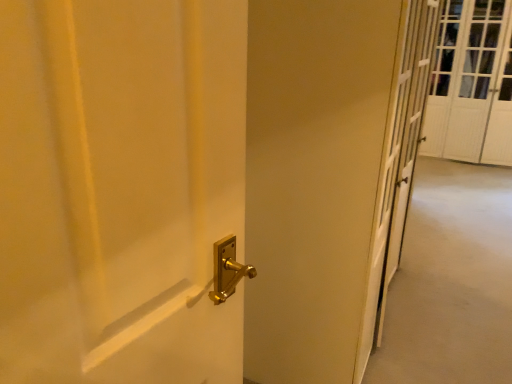
In order to face white textured screen door at upper right, should I rotate leftwards or rightwards?

You should rotate right by 28.157 degrees.

The height and width of the screenshot is (384, 512). What are the coordinates of `white textured screen door at upper right` in the screenshot? It's located at (472, 85).

This screenshot has width=512, height=384. What do you see at coordinates (472, 85) in the screenshot? I see `white textured screen door at upper right` at bounding box center [472, 85].

Identify the location of gold metallic door handle at center. (451, 281).

Describe the element at coordinates (451, 281) in the screenshot. The height and width of the screenshot is (384, 512). I see `gold metallic door handle at center` at that location.

This screenshot has height=384, width=512. In order to click on white textured screen door at upper right in this screenshot , I will do `click(472, 85)`.

Is gold metallic door handle at center at the right side of white textured screen door at upper right?

In fact, gold metallic door handle at center is to the left of white textured screen door at upper right.

Is gold metallic door handle at center further to camera compared to white textured screen door at upper right?

No, gold metallic door handle at center is in front of white textured screen door at upper right.

Does point (467, 273) appear closer or farther from the camera than point (476, 11)?

Clearly, point (467, 273) is closer to the camera than point (476, 11).

From the image's perspective, relative to white textured screen door at upper right, is gold metallic door handle at center above or below?

Based on their image positions, gold metallic door handle at center is located beneath white textured screen door at upper right.

From a real-world perspective, is gold metallic door handle at center above or below white textured screen door at upper right?

From a real-world perspective, gold metallic door handle at center is physically below white textured screen door at upper right.

Which of these two, gold metallic door handle at center or white textured screen door at upper right, is thinner?

white textured screen door at upper right is thinner.

Between gold metallic door handle at center and white textured screen door at upper right, which one has more height?

white textured screen door at upper right.

Looking at this image, is gold metallic door handle at center bigger than white textured screen door at upper right?

Incorrect, gold metallic door handle at center is not larger than white textured screen door at upper right.

Could white textured screen door at upper right be considered to be inside gold metallic door handle at center?

That's incorrect, white textured screen door at upper right is not inside gold metallic door handle at center.

Is gold metallic door handle at center not close to white textured screen door at upper right?

Indeed, gold metallic door handle at center is not near white textured screen door at upper right.

Is gold metallic door handle at center looking in the opposite direction of white textured screen door at upper right?

No, gold metallic door handle at center's orientation is not away from white textured screen door at upper right.

How many degrees apart are the facing directions of gold metallic door handle at center and white textured screen door at upper right?

The facing directions of gold metallic door handle at center and white textured screen door at upper right are 1.16 degrees apart.

Measure the distance from gold metallic door handle at center to white textured screen door at upper right.

gold metallic door handle at center and white textured screen door at upper right are 2.24 meters apart from each other.

Image resolution: width=512 pixels, height=384 pixels. In order to click on screen door above the gold metallic door handle at center (from a real-world perspective) in this screenshot , I will do `click(472, 85)`.

Is white textured screen door at upper right to the left of gold metallic door handle at center from the viewer's perspective?

In fact, white textured screen door at upper right is to the right of gold metallic door handle at center.

Who is more distant, white textured screen door at upper right or gold metallic door handle at center?

white textured screen door at upper right is behind.

Is point (425, 140) in front of point (430, 363)?

No.

From the image's perspective, is white textured screen door at upper right over gold metallic door handle at center?

Yes, from the image's perspective, white textured screen door at upper right is on top of gold metallic door handle at center.

From a real-world perspective, who is located lower, white textured screen door at upper right or gold metallic door handle at center?

gold metallic door handle at center.

Consider the image. Does white textured screen door at upper right have a lesser width compared to gold metallic door handle at center?

Indeed, white textured screen door at upper right has a lesser width compared to gold metallic door handle at center.

Who is taller, white textured screen door at upper right or gold metallic door handle at center?

white textured screen door at upper right.

Can you confirm if white textured screen door at upper right is smaller than gold metallic door handle at center?

Actually, white textured screen door at upper right might be larger than gold metallic door handle at center.

Is white textured screen door at upper right inside the boundaries of gold metallic door handle at center, or outside?

white textured screen door at upper right is outside gold metallic door handle at center.

Is white textured screen door at upper right placed right next to gold metallic door handle at center?

No, white textured screen door at upper right is not beside gold metallic door handle at center.

Is white textured screen door at upper right positioned with its back to gold metallic door handle at center?

No, white textured screen door at upper right is not facing away from gold metallic door handle at center.

How many degrees apart are the facing directions of white textured screen door at upper right and gold metallic door handle at center?

white textured screen door at upper right and gold metallic door handle at center are facing 1.16 degrees away from each other.

The image size is (512, 384). What are the coordinates of `screen door above the gold metallic door handle at center (from a real-world perspective)` in the screenshot? It's located at (472, 85).

Find the location of a particular element. The image size is (512, 384). screen door above the gold metallic door handle at center (from the image's perspective) is located at coordinates (472, 85).

You are a GUI agent. You are given a task and a screenshot of the screen. Output one action in this format:
    pyautogui.click(x=<x>, y=<y>)
    Task: Click on the corridor below the white textured screen door at upper right (from the image's perspective)
    Image resolution: width=512 pixels, height=384 pixels.
    Given the screenshot: What is the action you would take?
    pyautogui.click(x=451, y=281)